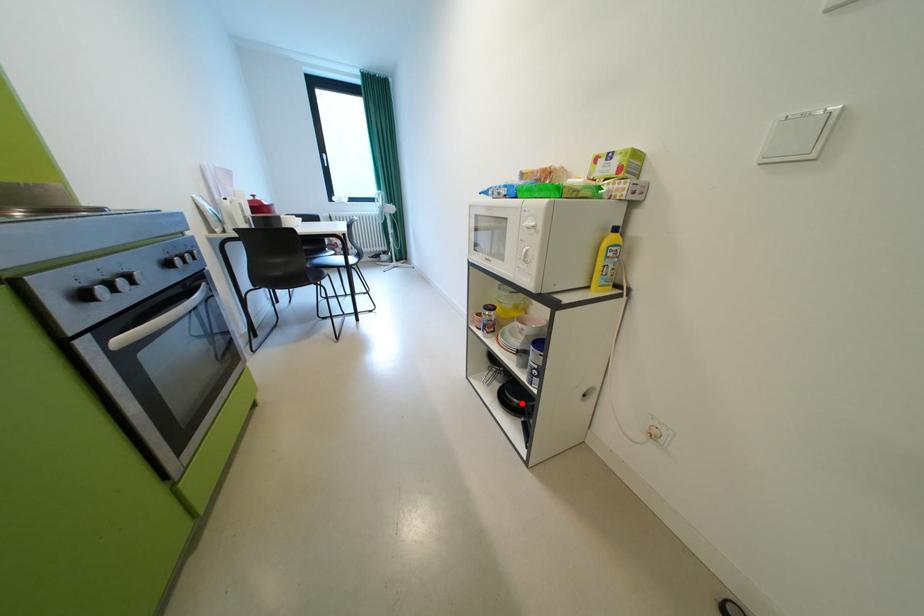
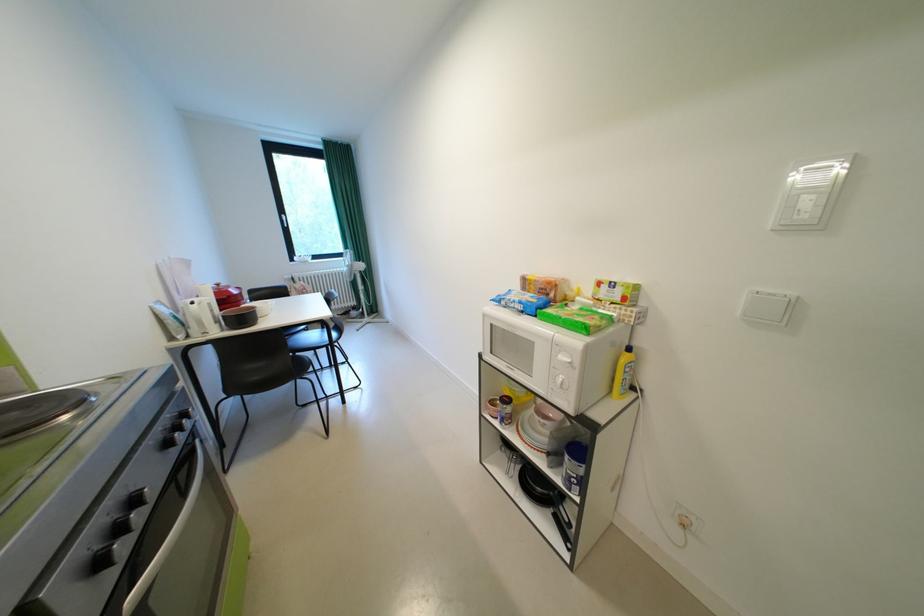
Where in the second image is the point corresponding to the highlighted location from the first image?

(544, 490)